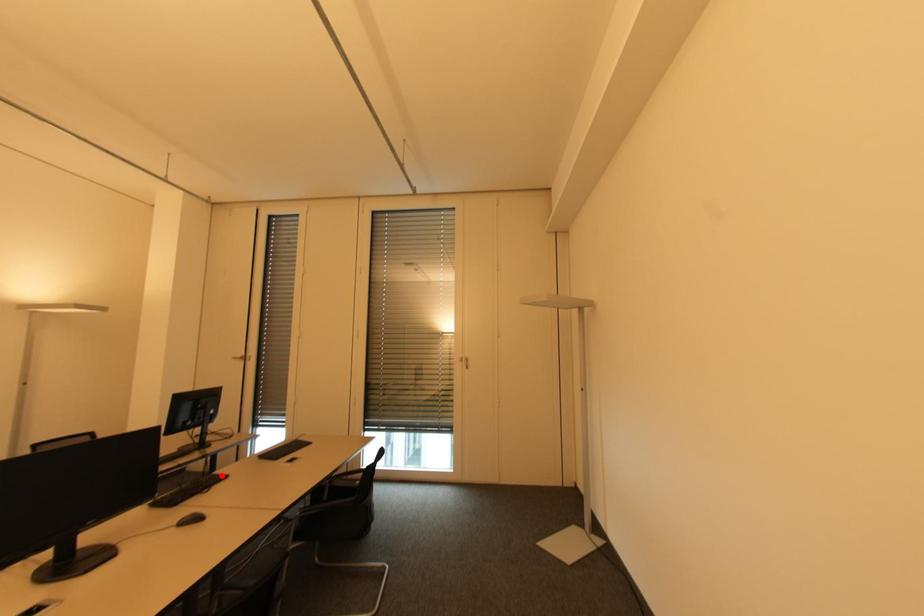
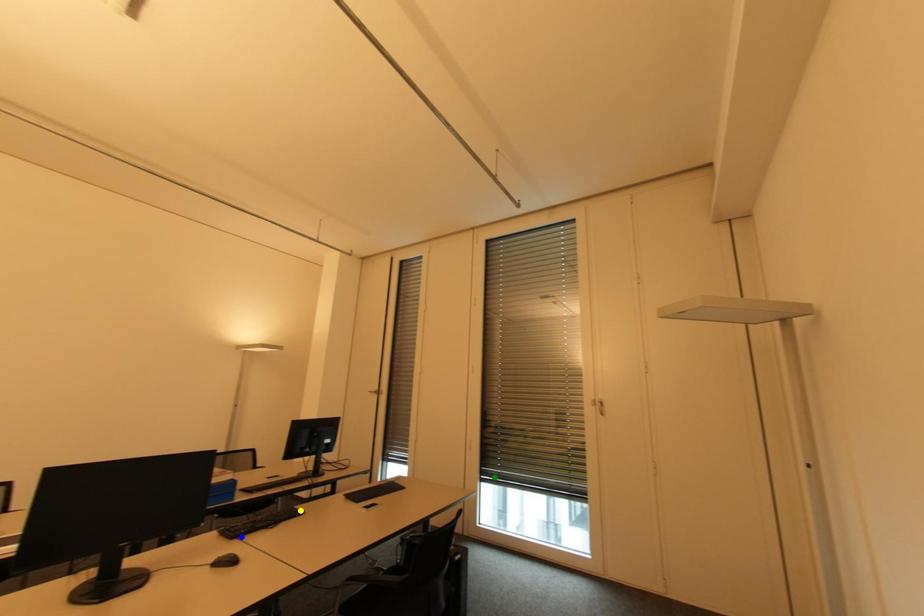
Question: I am providing you with two images of the same scene from different viewpoints. A red point is marked on the first image. You are given multiple points on the second image. Which spot in image 2 lines up with the point in image 1?

Choices:
 (A) blue point
 (B) yellow point
 (C) green point

Answer: (B)